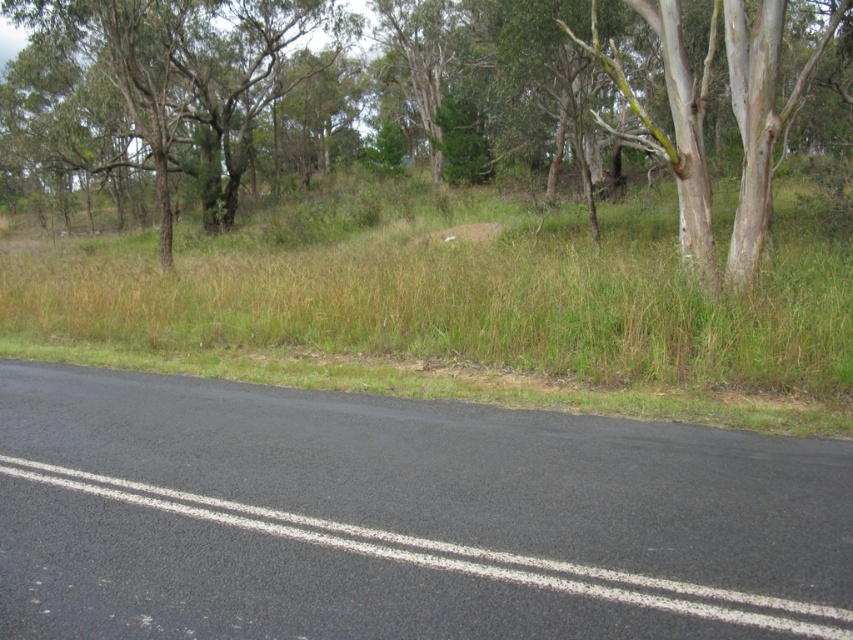
Question: Which is farther from the green leafy tree at upper center?

Choices:
 (A) green rough bark tree at upper left
 (B) green grass at center

Answer: (B)

Question: Does green grass at center appear on the right side of green rough bark tree at upper left?

Choices:
 (A) no
 (B) yes

Answer: (B)

Question: Based on their relative distances, which object is nearer to the green rough bark tree at upper left?

Choices:
 (A) green leafy tree at upper center
 (B) green grass at center

Answer: (A)

Question: Based on their relative distances, which object is nearer to the green rough bark tree at upper left?

Choices:
 (A) green leafy tree at upper center
 (B) green grass at center

Answer: (A)

Question: In this image, where is green grass at center located relative to green leafy tree at upper center?

Choices:
 (A) below
 (B) above

Answer: (A)

Question: Is green rough bark tree at upper left below green leafy tree at upper center?

Choices:
 (A) no
 (B) yes

Answer: (A)